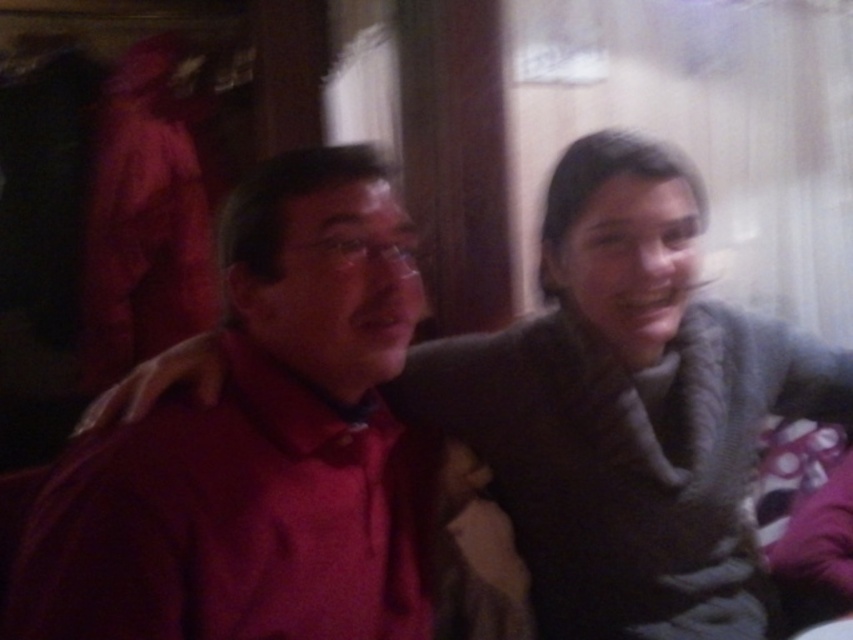
You are standing in front of a photo of two people sitting together. The person on the left is wearing a matte red shirt. If you want to place a 24 inch wide decorative frame around the matte red shirt at left, will it fit without overlapping the other person?

The distance between the matte red shirt at left and the viewer is 26.29 inches. Since the frame is 24 inches wide, it will fit as it is narrower than the available space.